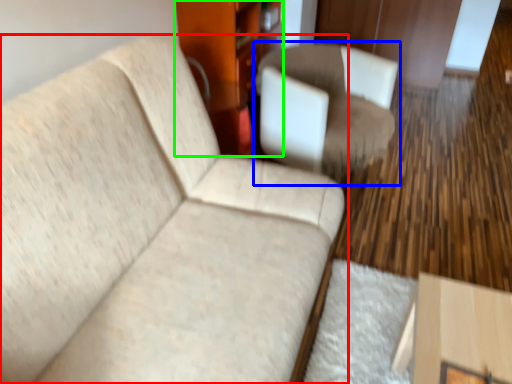
Question: Which object is positioned farthest from studio couch (highlighted by a red box)? Select from chair (highlighted by a blue box) and dresser (highlighted by a green box).

Choices:
 (A) chair
 (B) dresser

Answer: (B)